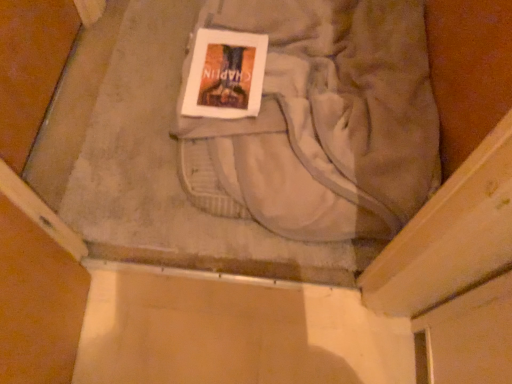
Question: From the image's perspective, is light gray cotton sweat pants at center positioned above or below hardcover book at center?

Choices:
 (A) above
 (B) below

Answer: (A)

Question: Is light gray cotton sweat pants at center inside the boundaries of hardcover book at center, or outside?

Choices:
 (A) outside
 (B) inside

Answer: (A)

Question: Considering the positions of light gray cotton sweat pants at center and hardcover book at center in the image, is light gray cotton sweat pants at center wider or thinner than hardcover book at center?

Choices:
 (A) thin
 (B) wide

Answer: (B)

Question: Does point (210, 107) appear closer or farther from the camera than point (302, 39)?

Choices:
 (A) farther
 (B) closer

Answer: (B)

Question: From a real-world perspective, is hardcover book at center above or below light gray cotton sweat pants at center?

Choices:
 (A) above
 (B) below

Answer: (A)

Question: Looking at the image, does hardcover book at center seem bigger or smaller compared to light gray cotton sweat pants at center?

Choices:
 (A) small
 (B) big

Answer: (A)

Question: Considering the positions of hardcover book at center and light gray cotton sweat pants at center in the image, is hardcover book at center wider or thinner than light gray cotton sweat pants at center?

Choices:
 (A) wide
 (B) thin

Answer: (B)